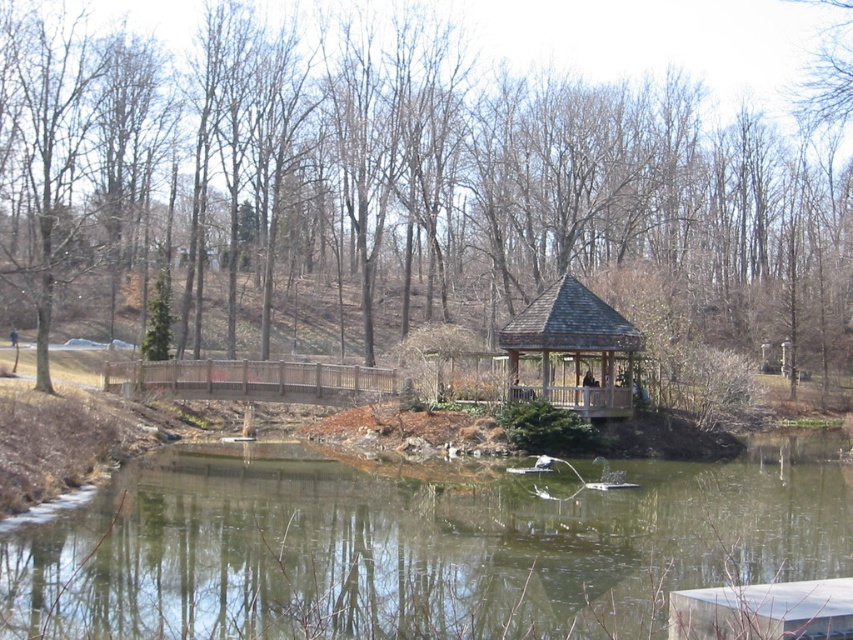
Who is positioned more to the left, green leafy tree at center or greenish reflective water at center?

Positioned to the left is greenish reflective water at center.

The image size is (853, 640). Identify the location of green leafy tree at center. (401, 186).

Is greenish reflective water at center below wooden gazebo at center?

Yes.

Is greenish reflective water at center shorter than wooden gazebo at center?

No.

Locate an element on the screen. Image resolution: width=853 pixels, height=640 pixels. greenish reflective water at center is located at coordinates (x=416, y=548).

Who is more forward, (372, 134) or (517, 388)?

Positioned in front is point (517, 388).

Is green leafy tree at center positioned at the back of wooden gazebo at center?

No, it is not.

Does point (795, 289) lie behind point (577, 289)?

Yes.

Where is `green leafy tree at center`? green leafy tree at center is located at coordinates (401, 186).